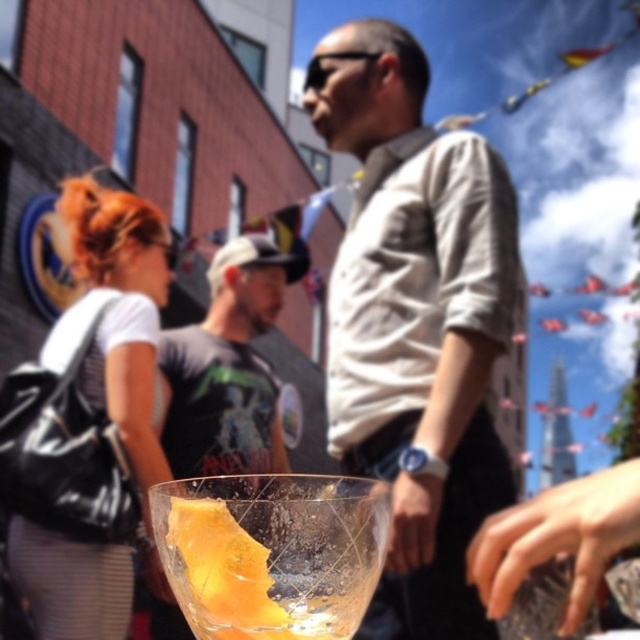
Is white matte shirt at center below matte black t-shirt at center?

No, white matte shirt at center is not below matte black t-shirt at center.

Which is more to the left, white matte shirt at center or matte black t-shirt at center?

matte black t-shirt at center

Is point (419, 401) farther from viewer compared to point (269, 280)?

No, it is not.

What are the coordinates of `white matte shirt at center` in the screenshot? It's located at (416, 323).

Can you confirm if matte black backpack at left is taller than matte black t-shirt at center?

Yes.

Is matte black backpack at left shorter than matte black t-shirt at center?

In fact, matte black backpack at left may be taller than matte black t-shirt at center.

Who is more distant from viewer, (108,193) or (180,362)?

The point (108,193) is more distant.

Find the location of a particular element. matte black backpack at left is located at coordinates (88, 422).

Can you confirm if matte black backpack at left is positioned above translucent glass at center?

Indeed, matte black backpack at left is positioned over translucent glass at center.

Who is taller, matte black backpack at left or translucent glass at center?

matte black backpack at left

The image size is (640, 640). What are the coordinates of `matte black backpack at left` in the screenshot? It's located at [x=88, y=422].

You are a GUI agent. You are given a task and a screenshot of the screen. Output one action in this format:
    pyautogui.click(x=<x>, y=<y>)
    Task: Click on the matte black backpack at left
    The height and width of the screenshot is (640, 640).
    Given the screenshot: What is the action you would take?
    tap(88, 422)